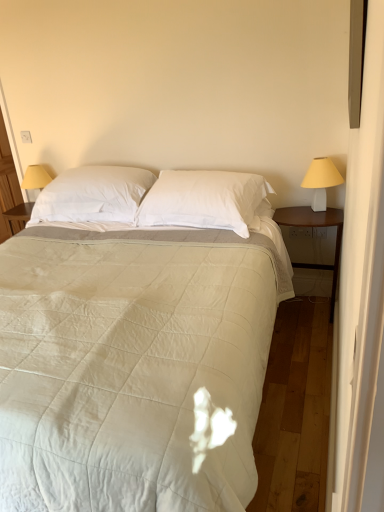
Question: Does white plastic lampshade at right have a greater height compared to white soft pillow at center, which is the 2th pillow in right-to-left order?

Choices:
 (A) no
 (B) yes

Answer: (A)

Question: Does white plastic lampshade at right come in front of white soft pillow at center, which is the 2th pillow in right-to-left order?

Choices:
 (A) no
 (B) yes

Answer: (B)

Question: Does white plastic lampshade at right turn towards white soft pillow at center, marked as the 1th pillow in a left-to-right arrangement?

Choices:
 (A) yes
 (B) no

Answer: (B)

Question: Is white plastic lampshade at right directly adjacent to white soft pillow at center, which is the 2th pillow in right-to-left order?

Choices:
 (A) no
 (B) yes

Answer: (A)

Question: From the image's perspective, is white plastic lampshade at right located above white soft pillow at center, marked as the 1th pillow in a left-to-right arrangement?

Choices:
 (A) yes
 (B) no

Answer: (B)

Question: From a real-world perspective, is white plastic lampshade at right positioned above or below white quilted fabric bed at center?

Choices:
 (A) below
 (B) above

Answer: (B)

Question: Considering the positions of white plastic lampshade at right and white quilted fabric bed at center in the image, is white plastic lampshade at right taller or shorter than white quilted fabric bed at center?

Choices:
 (A) tall
 (B) short

Answer: (B)

Question: Is white plastic lampshade at right bigger or smaller than white quilted fabric bed at center?

Choices:
 (A) big
 (B) small

Answer: (B)

Question: From the image's perspective, is white plastic lampshade at right positioned above or below white quilted fabric bed at center?

Choices:
 (A) below
 (B) above

Answer: (B)

Question: Considering the positions of white plastic lampshade at right and white soft pillow at center, marked as the 1th pillow in a left-to-right arrangement, in the image, is white plastic lampshade at right taller or shorter than white soft pillow at center, marked as the 1th pillow in a left-to-right arrangement,?

Choices:
 (A) short
 (B) tall

Answer: (A)

Question: Is point (314, 207) positioned closer to the camera than point (140, 183)?

Choices:
 (A) farther
 (B) closer

Answer: (A)

Question: From the image's perspective, is white plastic lampshade at right located above or below white soft pillow at center, which is the 2th pillow in right-to-left order?

Choices:
 (A) below
 (B) above

Answer: (A)

Question: Is white plastic lampshade at right in front of or behind white soft pillow at center, which is the 2th pillow in right-to-left order, in the image?

Choices:
 (A) behind
 (B) front

Answer: (B)

Question: In terms of width, does wooden nightstand at right look wider or thinner when compared to white soft pillow at center, marked as the 1th pillow in a left-to-right arrangement?

Choices:
 (A) wide
 (B) thin

Answer: (B)

Question: Considering their positions, is wooden nightstand at right located in front of or behind white soft pillow at center, marked as the 1th pillow in a left-to-right arrangement?

Choices:
 (A) front
 (B) behind

Answer: (A)